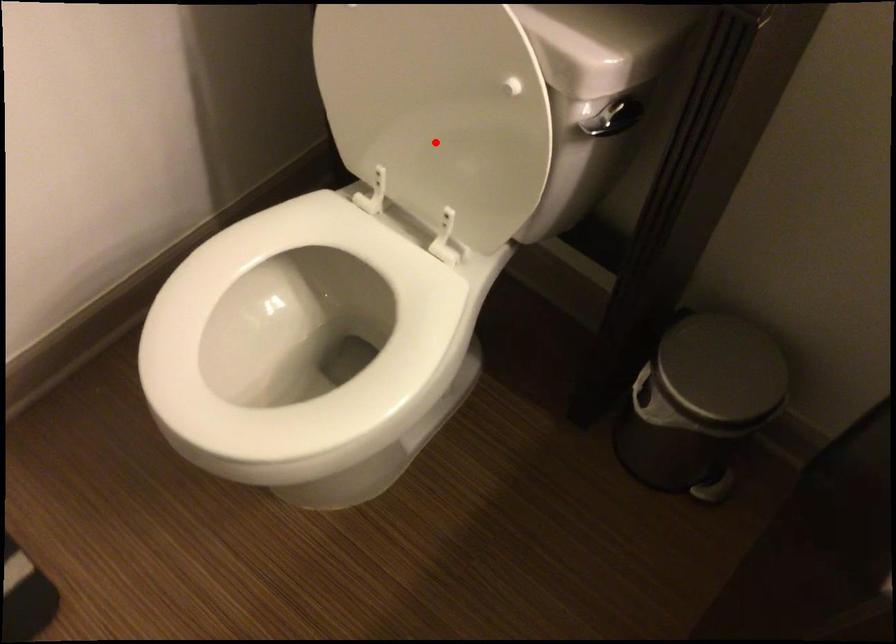
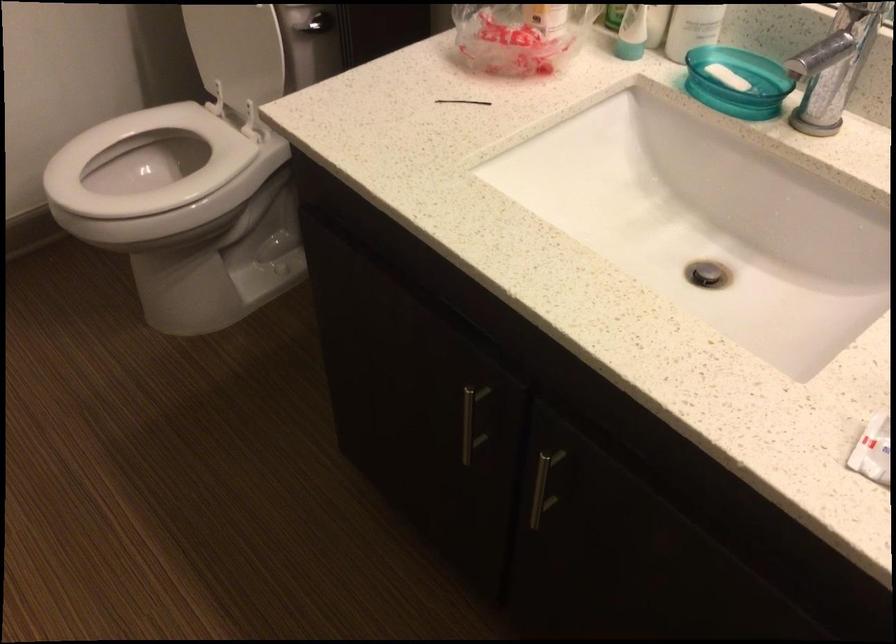
In the second image, find the point that corresponds to the highlighted location in the first image.

(237, 51)